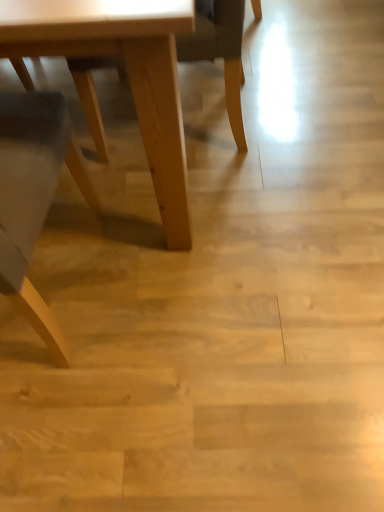
The width and height of the screenshot is (384, 512). What do you see at coordinates (127, 72) in the screenshot?
I see `light wood table at lower left` at bounding box center [127, 72].

This screenshot has width=384, height=512. In order to click on light wood table at lower left in this screenshot , I will do `click(127, 72)`.

Measure the distance between point [231,67] and camera.

Point [231,67] is 4.28 feet away from camera.

What is the approximate height of light brown wood chair at center?

light brown wood chair at center is 21.83 inches in height.

Where is `light brown wood chair at center`? This screenshot has width=384, height=512. light brown wood chair at center is located at coordinates (220, 52).

The height and width of the screenshot is (512, 384). What do you see at coordinates (220, 52) in the screenshot? I see `light brown wood chair at center` at bounding box center [220, 52].

At what (x,y) coordinates should I click in order to perform the action: click on light wood table at lower left. Please return your answer as a coordinate pair (x, y). The image size is (384, 512). Looking at the image, I should click on (127, 72).

Consider the image. Between light brown wood chair at center and light wood table at lower left, which one appears on the left side from the viewer's perspective?

light wood table at lower left.

Does light brown wood chair at center lie behind light wood table at lower left?

Yes, light brown wood chair at center is further from the viewer.

Which is in front, point (211, 28) or point (145, 151)?

The point (145, 151) is more forward.

From the image's perspective, is light brown wood chair at center above light wood table at lower left?

Yes, from the image's perspective, light brown wood chair at center is on top of light wood table at lower left.

From a real-world perspective, which is physically above, light brown wood chair at center or light wood table at lower left?

light wood table at lower left is physically above.

Consider the image. Considering the relative sizes of light brown wood chair at center and light wood table at lower left in the image provided, is light brown wood chair at center wider than light wood table at lower left?

No.

Which of these two, light brown wood chair at center or light wood table at lower left, stands taller?

light wood table at lower left.

Can you confirm if light brown wood chair at center is smaller than light wood table at lower left?

Yes, light brown wood chair at center is smaller than light wood table at lower left.

Can light wood table at lower left be found inside light brown wood chair at center?

That's incorrect, light wood table at lower left is not inside light brown wood chair at center.

Can you see light brown wood chair at center touching light wood table at lower left?

No, light brown wood chair at center is not beside light wood table at lower left.

Is light brown wood chair at center facing away from light wood table at lower left?

No, light brown wood chair at center is not facing away from light wood table at lower left.

How much distance is there between light brown wood chair at center and light wood table at lower left?

They are 37.59 centimeters apart.

This screenshot has height=512, width=384. What are the coordinates of `table located on the left of light brown wood chair at center` in the screenshot? It's located at (127, 72).

Is light wood table at lower left to the left of light brown wood chair at center from the viewer's perspective?

Indeed, light wood table at lower left is positioned on the left side of light brown wood chair at center.

Relative to light brown wood chair at center, is light wood table at lower left in front or behind?

light wood table at lower left is positioned closer to the viewer than light brown wood chair at center.

Which is behind, point (153, 176) or point (239, 40)?

The point (239, 40) is more distant.

From the image's perspective, is light wood table at lower left below light brown wood chair at center?

Yes.

From a real-world perspective, is light wood table at lower left physically located above or below light brown wood chair at center?

light wood table at lower left is above light brown wood chair at center.

Does light wood table at lower left have a lesser width compared to light brown wood chair at center?

No, light wood table at lower left is not thinner than light brown wood chair at center.

Which of these two, light wood table at lower left or light brown wood chair at center, stands taller?

light wood table at lower left.

Does light wood table at lower left have a smaller size compared to light brown wood chair at center?

No, light wood table at lower left is not smaller than light brown wood chair at center.

From the picture: Would you say light brown wood chair at center is part of light wood table at lower left's contents?

That's incorrect, light brown wood chair at center is not inside light wood table at lower left.

Would you consider light wood table at lower left to be distant from light brown wood chair at center?

They are positioned close to each other.

Based on the photo, is light wood table at lower left oriented towards light brown wood chair at center?

No, light wood table at lower left does not turn towards light brown wood chair at center.

What's the angular difference between light wood table at lower left and light brown wood chair at center's facing directions?

The facing directions of light wood table at lower left and light brown wood chair at center are 92.6 degrees apart.

Measure the distance between light wood table at lower left and light brown wood chair at center.

light wood table at lower left is 37.59 centimeters from light brown wood chair at center.

Identify the location of table that appears above the light brown wood chair at center (from a real-world perspective). This screenshot has height=512, width=384. (127, 72).

Locate an element on the screen. chair that is under the light wood table at lower left (from a real-world perspective) is located at coordinates (220, 52).

Locate an element on the screen. table above the light brown wood chair at center (from a real-world perspective) is located at coordinates (127, 72).